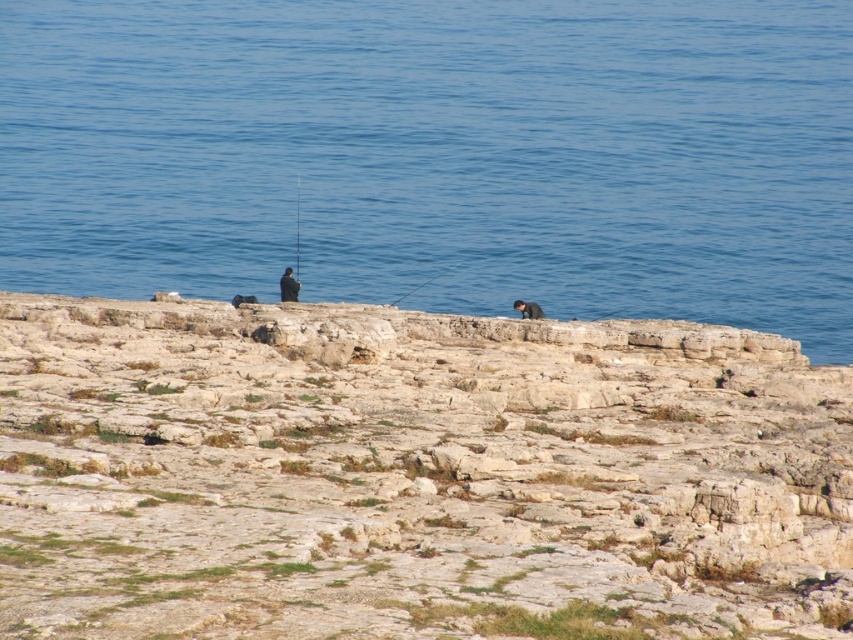
You are a photographer standing at the shoreline. You want to capture both the dark blue wetsuit at center and the smooth black rod at center in a single frame. Given that your camera has a maximum focal length that allows capturing objects up to 15 meters apart, will you be able to include both subjects in the photo?

The dark blue wetsuit at center and smooth black rod at center are 16.55 meters apart, which exceeds the camera maximum focal length of 15 meters. Therefore, you won

You are a photographer planning to capture the scene with the dark blue wetsuit at center and the smooth black rod at center. Which object should you focus on first if you want to highlight the smaller one?

The dark blue wetsuit at center occupies less space than the smooth black rod at center, so you should focus on the dark blue wetsuit at center first to highlight the smaller one.